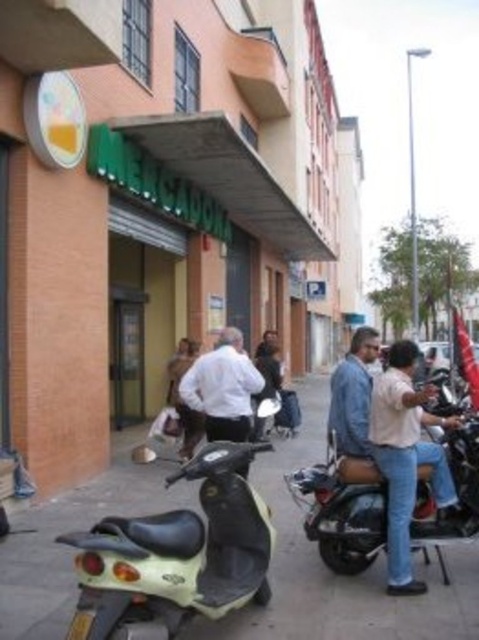
You are standing on the sidewalk in front of Mercadona. You see the smooth concrete pavement at center and the white matte shirt at center. Which object is larger in size?

The smooth concrete pavement at center is bigger than the white matte shirt at center.